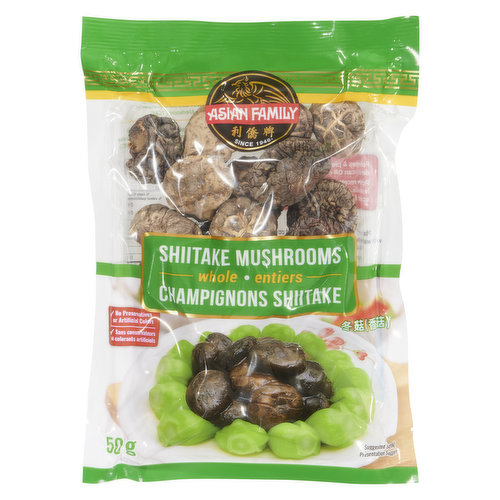
In order to click on picture of a plate in this screenshot , I will do `click(140, 419)`.